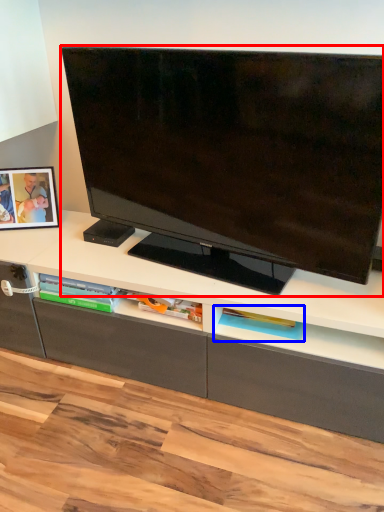
Question: Which object appears closest to the camera in this image, television (highlighted by a red box) or shelf (highlighted by a blue box)?

Choices:
 (A) television
 (B) shelf

Answer: (A)